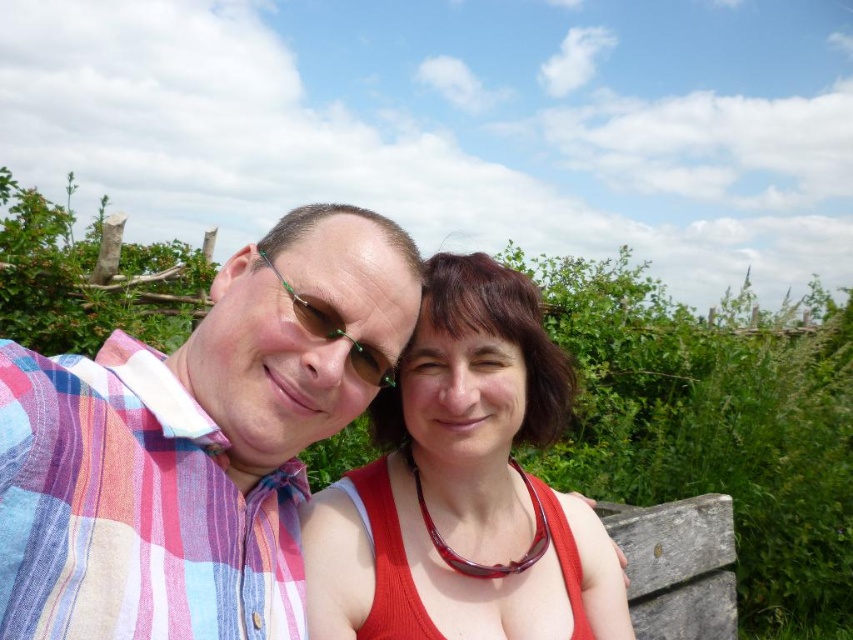
You are a photographer planning to take a group photo of the plaid shirt at left and the matte red tank top at center. Since you want both subjects to appear the same size in the final photo, what adjustment should you make to your camera position or their positions?

To make both the plaid shirt at left and the matte red tank top at center appear the same size in the photo, you should move the plaid shirt at left farther away from the camera or bring the matte red tank top at center closer, since the plaid shirt at left is bigger than the matte red tank top at center.